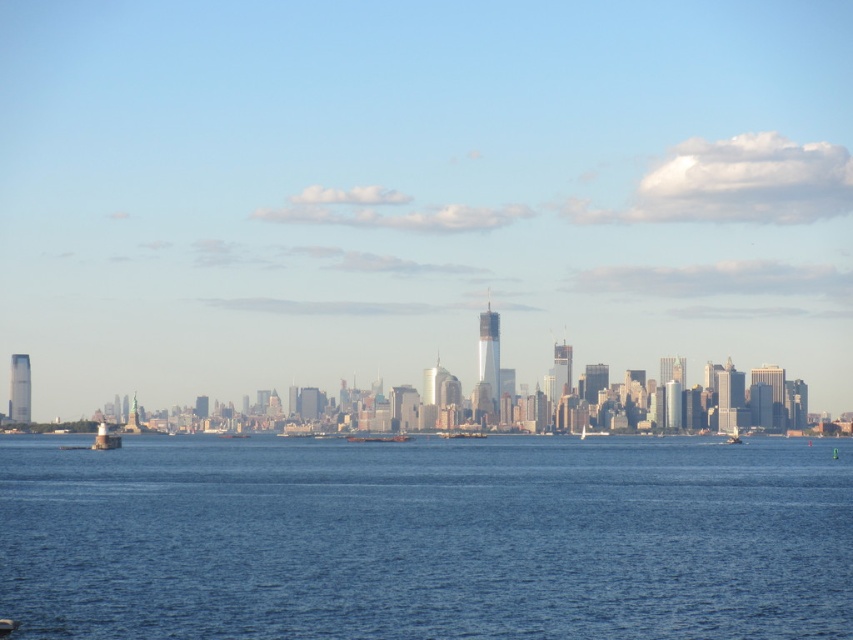
Based on the photo, you are a photographer planning to capture the city skyline reflected in the blue liquid water at center. However, there is a metallic gray boat at center in the way. Will the boat obstruct the reflection of the skyscraper under construction in the water?

The blue liquid water at center is taller than the metallic gray boat at center, so the boat will not obstruct the reflection of the skyscraper under construction in the water.

You are a drone operator who needs to fly a drone from the starting point at the bottom left corner of the image to the transparent glass skyscrapers at center. According to the coordinates provided, in which direction should you initially fly the drone to reach the skyscrapers?

The transparent glass skyscrapers at center are located at coordinates point (x=419, y=192). Since the starting point is at the bottom left corner, you should initially fly the drone to the northeast direction to reach the skyscrapers.